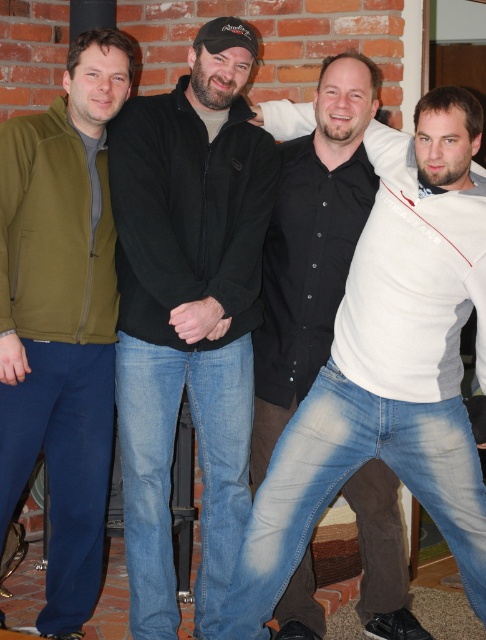
You are standing in the room where the four men are posing. You need to locate the black matte jacket at center. Where exactly is it positioned in the room?

The black matte jacket at center is positioned at coordinates point (188, 310) in the room.

Based on the photo, you are a photographer trying to adjust the lighting for a group photo. You notice two jackets in the scene. Which jacket is closer to you, the photographer, between the black matte jacket at center and the olive green fleece jacket at left?

The black matte jacket at center is closer to you, the photographer, as it is positioned further to the viewer than the olive green fleece jacket at left.